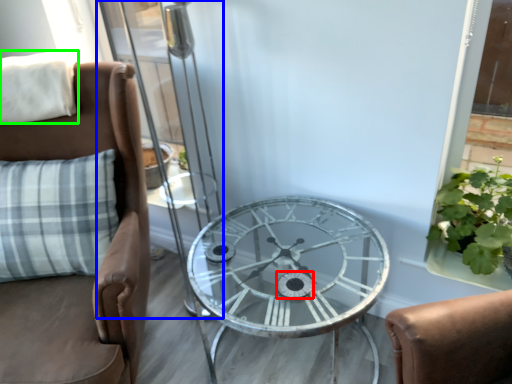
Question: Which object is positioned closest to oval (highlighted by a red box)? Select from screen door (highlighted by a blue box) and pillow (highlighted by a green box).

Choices:
 (A) screen door
 (B) pillow

Answer: (B)